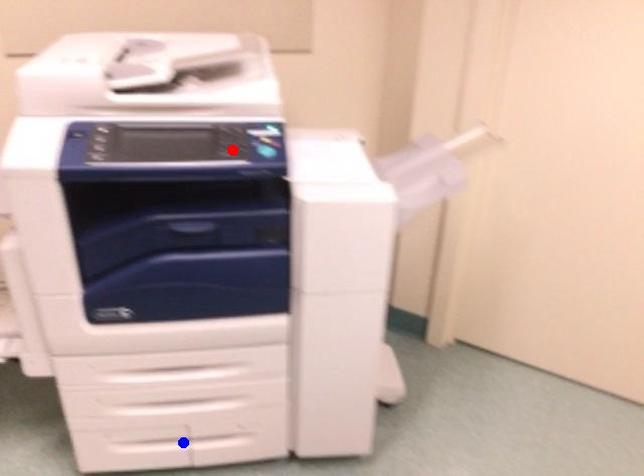
Question: Which of the two points in the image is closer to the camera?

Choices:
 (A) Blue point is closer.
 (B) Red point is closer.

Answer: (B)